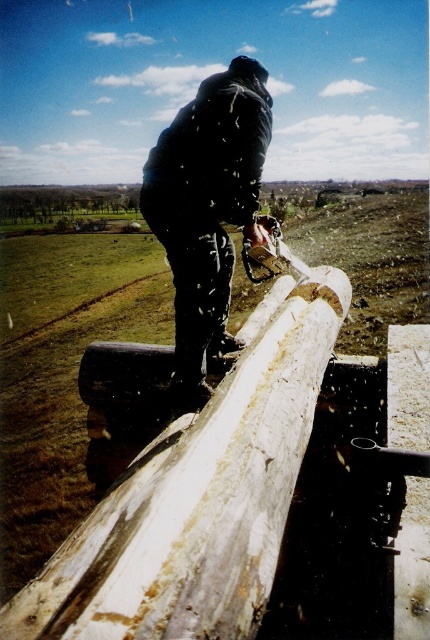
You are a carpenter assessing the dimensions of materials in the scene. You see the white wood beam at center and the dark blue jacket at upper center. Which object is wider?

The white wood beam at center is wider than the dark blue jacket at upper center according to the description.